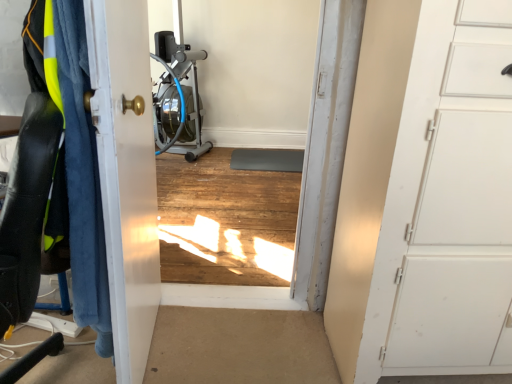
Question: From the image's perspective, relative to matte black swivel chair at left, is white glossy door at left, arranged as the second door when viewed from the right, above or below?

Choices:
 (A) above
 (B) below

Answer: (A)

Question: Considering the relative positions of white glossy door at left, which appears as the 1th door when viewed from the left, and matte black swivel chair at left in the image provided, is white glossy door at left, which appears as the 1th door when viewed from the left, to the left or to the right of matte black swivel chair at left?

Choices:
 (A) left
 (B) right

Answer: (B)

Question: Based on their relative distances, which object is farther from the matte black swivel chair at left?

Choices:
 (A) white matte door at right, which is counted as the second door, starting from the left
 (B) metallic silver rowing machine at center
 (C) blue fuzzy blanket at left
 (D) white glossy door at left, arranged as the second door when viewed from the right

Answer: (B)

Question: Which of these objects is positioned closest to the white glossy door at left, arranged as the second door when viewed from the right?

Choices:
 (A) metallic silver rowing machine at center
 (B) white matte door at right, the 1th door from the right
 (C) matte black swivel chair at left
 (D) blue fuzzy blanket at left

Answer: (D)